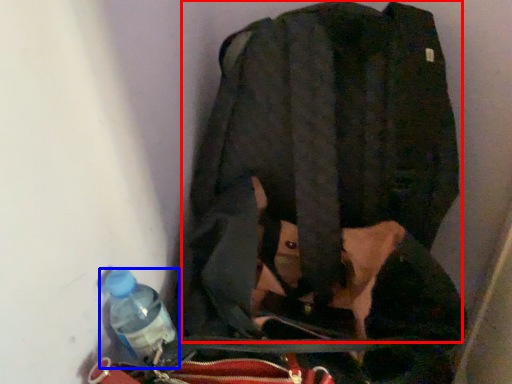
Question: Among these objects, which one is farthest to the camera, jacket (highlighted by a red box) or bottle (highlighted by a blue box)?

Choices:
 (A) jacket
 (B) bottle

Answer: (B)